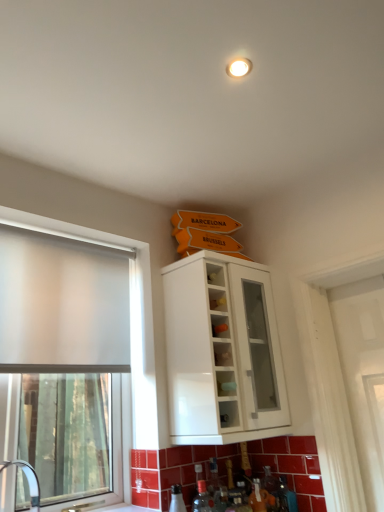
Question: Would you say frosted glass window at left is part of white glossy cabinet at upper center's contents?

Choices:
 (A) yes
 (B) no

Answer: (B)

Question: Is white glossy cabinet at upper center positioned with its back to frosted glass window at left?

Choices:
 (A) yes
 (B) no

Answer: (B)

Question: From a real-world perspective, does white glossy cabinet at upper center sit lower than frosted glass window at left?

Choices:
 (A) yes
 (B) no

Answer: (B)

Question: Does white glossy cabinet at upper center appear on the left side of frosted glass window at left?

Choices:
 (A) no
 (B) yes

Answer: (A)

Question: Does white glossy cabinet at upper center have a greater width compared to frosted glass window at left?

Choices:
 (A) no
 (B) yes

Answer: (B)

Question: Does point [x=31, y=476] appear closer or farther from the camera than point [x=180, y=407]?

Choices:
 (A) closer
 (B) farther

Answer: (B)

Question: Looking at their shapes, would you say white glossy sink at lower left is wider or thinner than white glossy cabinet at upper center?

Choices:
 (A) wide
 (B) thin

Answer: (B)

Question: From a real-world perspective, is white glossy sink at lower left physically located above or below white glossy cabinet at upper center?

Choices:
 (A) below
 (B) above

Answer: (A)

Question: Visually, is white glossy sink at lower left positioned to the left or to the right of white glossy cabinet at upper center?

Choices:
 (A) left
 (B) right

Answer: (A)

Question: From a real-world perspective, is frosted glass window at left physically located above or below white glossy cabinet at upper center?

Choices:
 (A) below
 (B) above

Answer: (A)

Question: Is frosted glass window at left taller or shorter than white glossy cabinet at upper center?

Choices:
 (A) short
 (B) tall

Answer: (B)

Question: Does point (59, 352) appear closer or farther from the camera than point (175, 396)?

Choices:
 (A) closer
 (B) farther

Answer: (A)

Question: Looking at their shapes, would you say frosted glass window at left is wider or thinner than white glossy cabinet at upper center?

Choices:
 (A) wide
 (B) thin

Answer: (B)

Question: Considering the relative positions of frosted glass window at left and white glossy sink at lower left in the image provided, is frosted glass window at left to the left or to the right of white glossy sink at lower left?

Choices:
 (A) left
 (B) right

Answer: (A)

Question: In the image, is frosted glass window at left positioned in front of or behind white glossy sink at lower left?

Choices:
 (A) behind
 (B) front

Answer: (A)